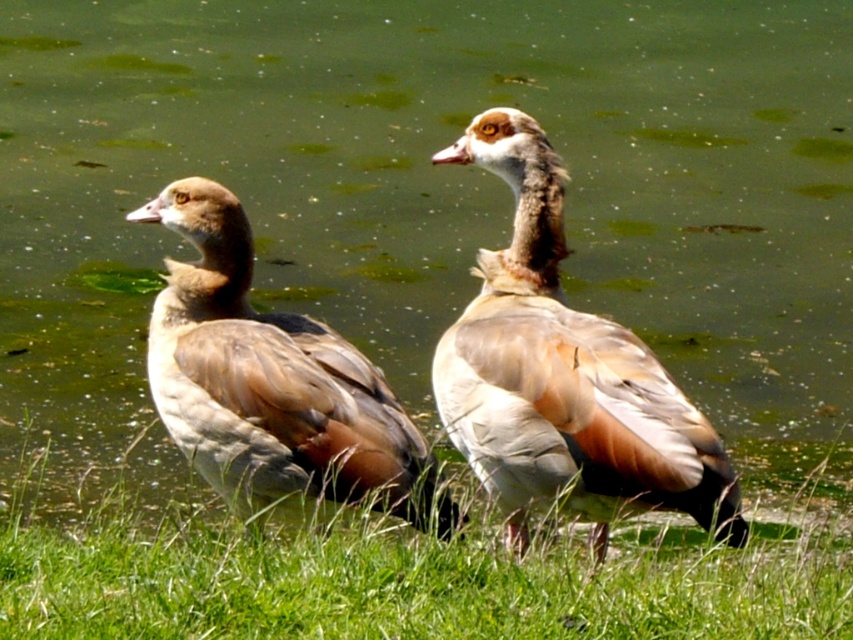
You are standing at the edge of the pond and want to place a small decorative rock on the green grass at lower center. According to the coordinates provided, where exactly should you place the rock?

The green grass at lower center is located at point (x=410, y=580), so you should place the rock there.

You are a birdwatcher observing the scene from the left side of the image. You see the brown feathered duck at center. Can you determine its exact location in the image using coordinates?

The brown feathered duck at center is located at coordinates point (563, 372).

You are standing at the edge of the pond and want to walk towards the green grass at lower center. Based on the coordinates provided in the description, which direction should you move relative to your current position?

The green grass at lower center is located at point (x=410, y=580), which means it is positioned towards the lower right of the image. Since you are at the edge of the pond, you should move towards the lower right direction to reach the green grass at lower center.